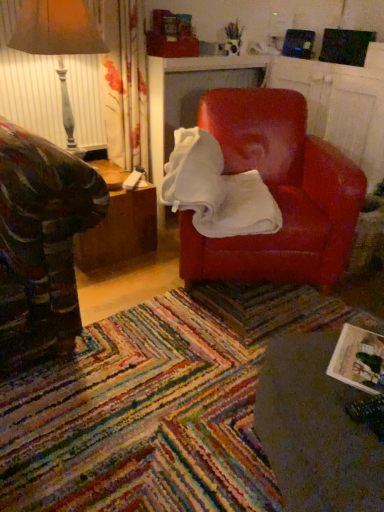
This screenshot has width=384, height=512. I want to click on vacant space situated above wooden table at lower right, which appears as the 1th table when ordered from the bottom (from a real-world perspective), so click(347, 383).